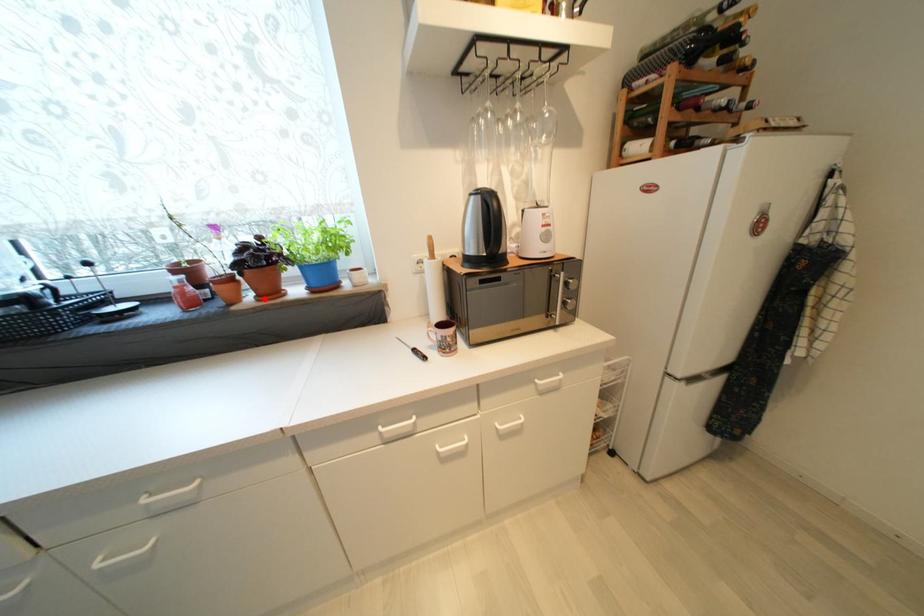
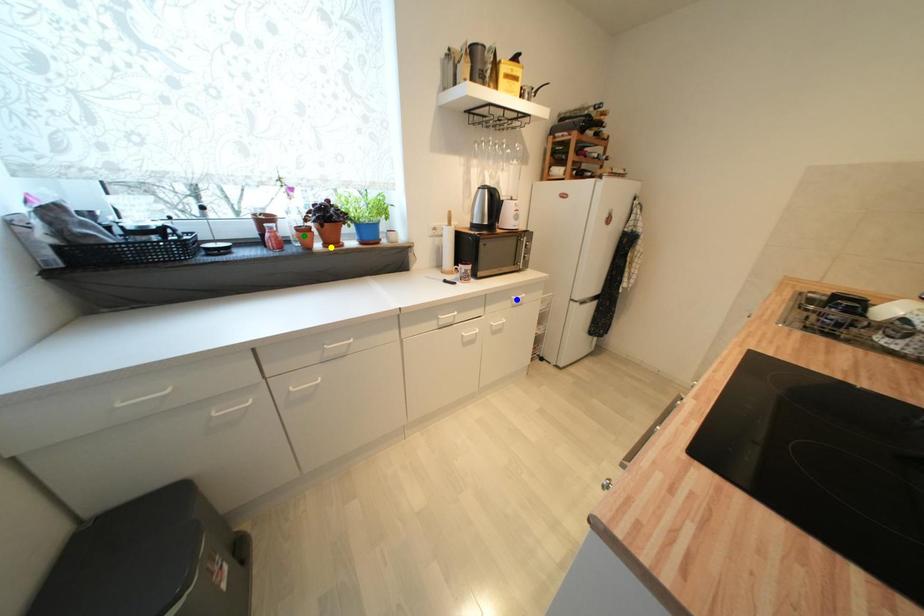
Question: I am providing you with two images of the same scene from different viewpoints. A red point is marked on the first image. You are given multiple points on the second image. Which point in image 2 is actually the same real-world point as the red point in image 1?

Choices:
 (A) green point
 (B) blue point
 (C) yellow point

Answer: (C)